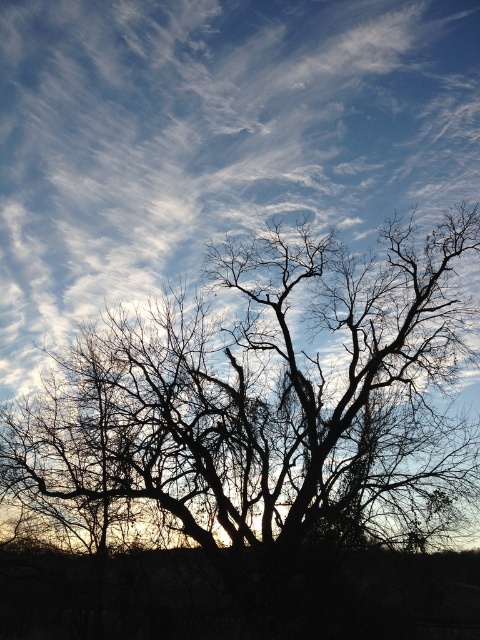
Question: Does white cotton cloud at upper center appear on the right side of silhouette bark tree at center?

Choices:
 (A) no
 (B) yes

Answer: (A)

Question: Can you confirm if white cotton cloud at upper center is bigger than silhouette bark tree at center?

Choices:
 (A) no
 (B) yes

Answer: (A)

Question: Which point appears closest to the camera in this image?

Choices:
 (A) click(443, 440)
 (B) click(60, 20)

Answer: (A)

Question: Which object is farther from the camera taking this photo?

Choices:
 (A) silhouette bark tree at center
 (B) white cotton cloud at upper center

Answer: (B)

Question: Which of the following is the closest to the observer?

Choices:
 (A) (441, 196)
 (B) (280, 275)

Answer: (B)

Question: Is the position of white cotton cloud at upper center more distant than that of silhouette bark tree at center?

Choices:
 (A) yes
 (B) no

Answer: (A)